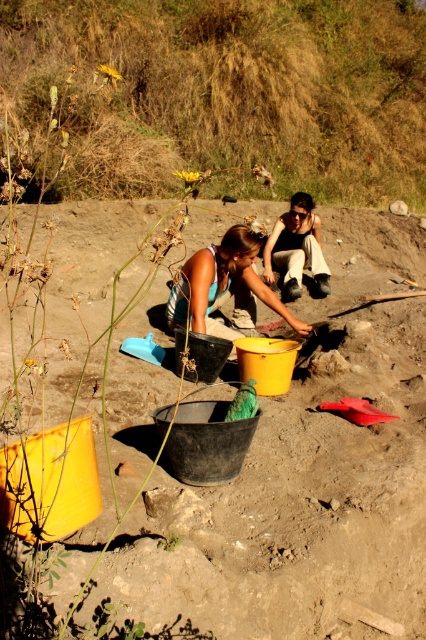
Who is more distant from viewer, [354,388] or [296,212]?

The point [296,212] is behind.

Between point (347, 237) and point (299, 241), which one is positioned in front?

Point (299, 241)

Who is more distant from viewer, [419,268] or [279,237]?

Point [419,268]

This screenshot has width=426, height=640. In order to click on yellow matte bucket at center in this screenshot , I will do `click(307, 480)`.

Is matte blue tank top at center further to the viewer compared to matte black pants at center?

Answer: No.

What are the coordinates of `matte blue tank top at center` in the screenshot? It's located at (224, 289).

Between brown grassy hillside at upper center and matte blue tank top at center, which one appears on the right side from the viewer's perspective?

brown grassy hillside at upper center is more to the right.

Is brown grassy hillside at upper center below matte blue tank top at center?

No, brown grassy hillside at upper center is not below matte blue tank top at center.

Is point (17, 42) positioned after point (221, 246)?

That is True.

Find the location of `brown grassy hillside at upper center`. brown grassy hillside at upper center is located at coordinates (221, 93).